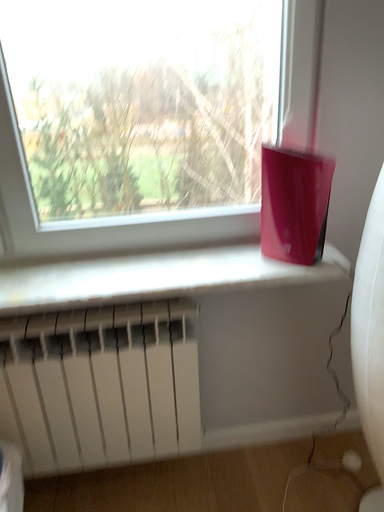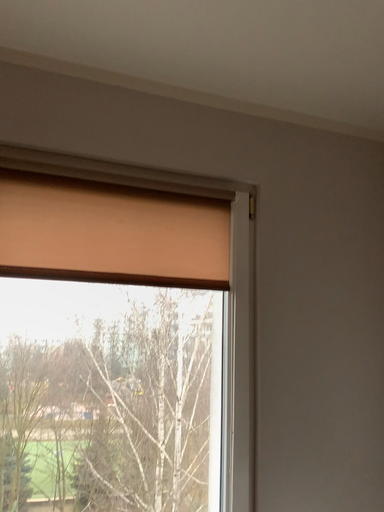
Question: How did the camera likely rotate when shooting the video?

Choices:
 (A) rotated downward
 (B) rotated upward

Answer: (B)